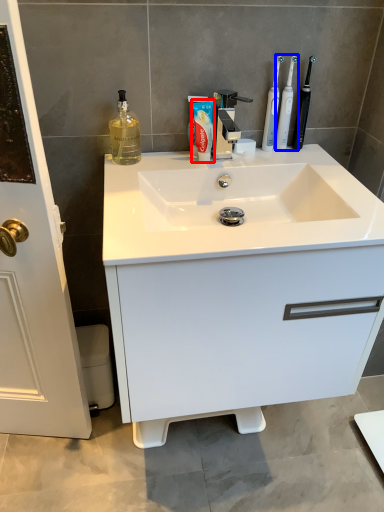
Question: Which object is further to the camera taking this photo, shaving cream (highlighted by a red box) or toothbrush (highlighted by a blue box)?

Choices:
 (A) shaving cream
 (B) toothbrush

Answer: (B)